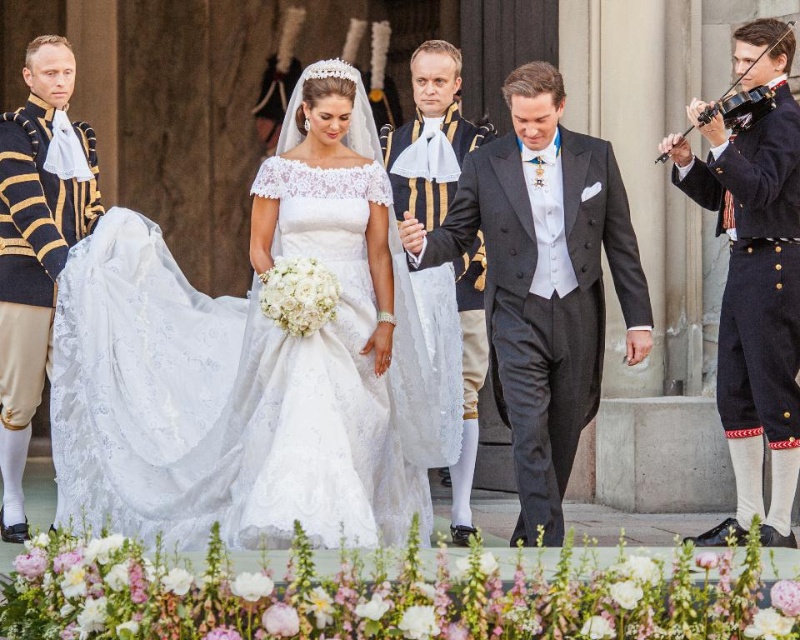
You are a photographer positioned to the side of the wedding steps. You need to ensure both the white lace dress at center and the matte black suit at center are fully visible in the frame. Given that the dress is wider, which part of the couple might require more attention to avoid being cropped out?

The white lace dress at center has a larger width than the matte black suit at center, so the photographer should pay more attention to the edges of the dress to ensure it is fully visible in the frame without being cropped out.

You are a photographer at the wedding. You want to capture a closeup shot of the bride in her white lace dress at center without the groom in the frame. Since the lace fabric dress at center is partially blocking the view, can you adjust your position to avoid it?

A: The white lace dress at center might be wider than lace fabric dress at center, so if the white lace dress at center is wider, adjusting your position slightly to the side could allow you to capture the bride without the groom or the lace fabric dress at center obstructing the view. However, if the widths are similar, you might need to move further to the side or closer to ensure the lace fabric dress at center doesn

You are a photographer positioned at the bottom of the stairs where the bride and groom are walking. You need to capture a photo that includes both the white lace dress at center and the matte black suit at center. Given that your camera has a maximum focus range of 5 meters, will you be able to capture both subjects in focus?

The distance between the white lace dress at center and the matte black suit at center is 7.20 meters, which exceeds the camera maximum focus range of 5 meters. Therefore, you cannot capture both subjects in focus.